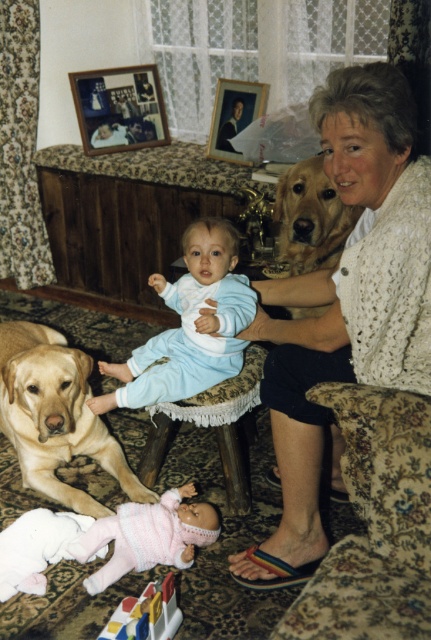
Question: Does golden fur dog at upper right come in front of plastic colorful blocks at lower center?

Choices:
 (A) yes
 (B) no

Answer: (B)

Question: Is light blue soft fabric baby at center further to the viewer compared to golden fur dog at upper right?

Choices:
 (A) no
 (B) yes

Answer: (A)

Question: Considering the real-world distances, which object is farthest from the woodenobject at upper center?

Choices:
 (A) golden fur dog at upper right
 (B) floral fabric couch at lower center
 (C) white knitted sweater at upper right
 (D) light blue soft fabric baby at center

Answer: (B)

Question: Among these objects, which one is nearest to the camera?

Choices:
 (A) knitted pink sweater at lower center
 (B) white knitted sweater at upper right
 (C) floral fabric couch at lower center
 (D) plastic colorful blocks at lower center

Answer: (C)

Question: In this image, where is golden fur dog at lower left located relative to light blue soft fabric baby at center?

Choices:
 (A) below
 (B) above

Answer: (A)

Question: Which object is closer to the camera taking this photo?

Choices:
 (A) floral fabric couch at lower center
 (B) golden fur dog at lower left
 (C) knitted pink sweater at lower center

Answer: (A)